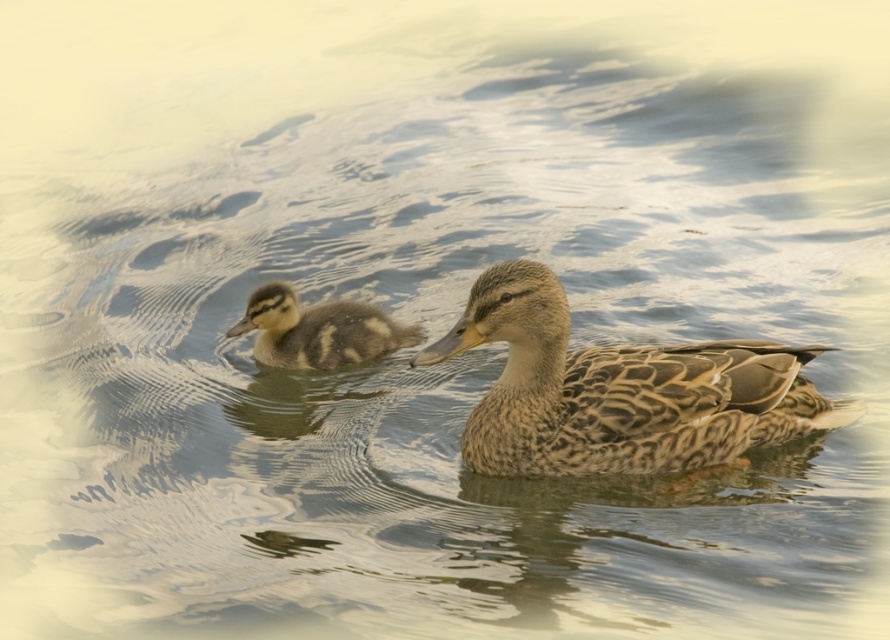
Question: Where is brown speckled duck at center located in relation to brown speckled duckling at left in the image?

Choices:
 (A) above
 (B) below

Answer: (B)

Question: Which object appears farthest from the camera in this image?

Choices:
 (A) brown speckled duckling at left
 (B) brown speckled duck at center

Answer: (A)

Question: Does brown speckled duck at center have a greater width compared to brown speckled duckling at left?

Choices:
 (A) yes
 (B) no

Answer: (A)

Question: Which point appears farthest from the camera in this image?

Choices:
 (A) (369, 344)
 (B) (762, 381)

Answer: (A)

Question: Can you confirm if brown speckled duck at center is smaller than brown speckled duckling at left?

Choices:
 (A) yes
 (B) no

Answer: (B)

Question: Which object is closer to the camera taking this photo?

Choices:
 (A) brown speckled duck at center
 (B) brown speckled duckling at left

Answer: (A)